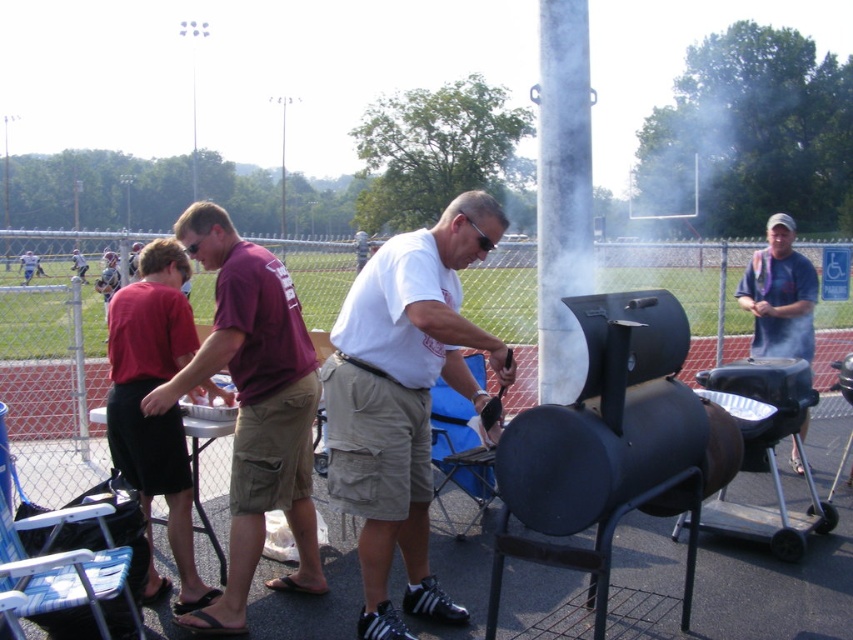
Is black matte barbecue grill at center wider than maroon fabric shirt at center?

Indeed, black matte barbecue grill at center has a greater width compared to maroon fabric shirt at center.

Does point (711, 483) come behind point (299, 580)?

No, (711, 483) is closer to viewer.

Who is more forward, [577,531] or [236,476]?

Point [577,531] is more forward.

You are a GUI agent. You are given a task and a screenshot of the screen. Output one action in this format:
    pyautogui.click(x=<x>, y=<y>)
    Task: Click on the black matte barbecue grill at center
    This screenshot has height=640, width=853.
    Given the screenshot: What is the action you would take?
    pyautogui.click(x=612, y=449)

Where is `black matte barbecue grill at center`? The width and height of the screenshot is (853, 640). black matte barbecue grill at center is located at coordinates (612, 449).

Is black matte barbecue grill at center shorter than white matte shirt at center?

No.

Which is behind, point (550, 458) or point (361, 312)?

Positioned behind is point (361, 312).

The height and width of the screenshot is (640, 853). Find the location of `black matte barbecue grill at center`. black matte barbecue grill at center is located at coordinates (612, 449).

Can you confirm if white matte shirt at center is wider than maroon t-shirt at center?

No.

Is white matte shirt at center in front of maroon t-shirt at center?

Yes, it is in front of maroon t-shirt at center.

Is point (480, 227) farther from camera compared to point (73, 269)?

No, it is in front of (73, 269).

You are a GUI agent. You are given a task and a screenshot of the screen. Output one action in this format:
    pyautogui.click(x=<x>, y=<y>)
    Task: Click on the white matte shirt at center
    
    Given the screenshot: What is the action you would take?
    pyautogui.click(x=403, y=400)